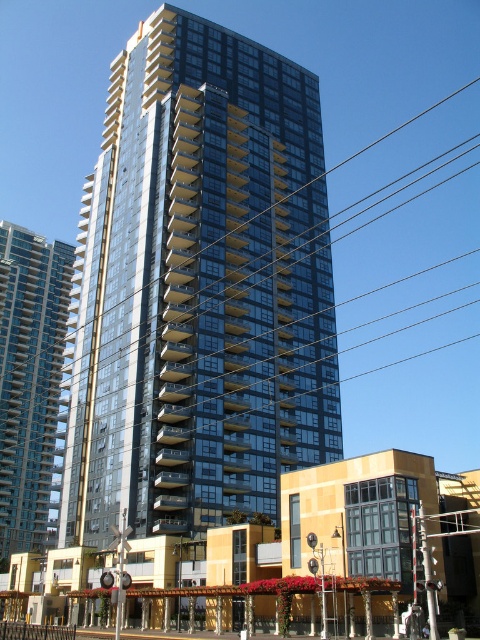
Question: Can you confirm if glassy reflective building at center is positioned to the right of transparent glass building at center?

Choices:
 (A) no
 (B) yes

Answer: (B)

Question: Which point is farther to the camera?

Choices:
 (A) (210, 484)
 (B) (10, 294)

Answer: (B)

Question: Which object is closer to the camera taking this photo?

Choices:
 (A) transparent glass building at center
 (B) glassy reflective building at center

Answer: (B)

Question: Observing the image, what is the correct spatial positioning of glassy reflective building at center in reference to transparent glass building at center?

Choices:
 (A) below
 (B) above

Answer: (B)

Question: Can you confirm if glassy reflective building at center is smaller than transparent glass building at center?

Choices:
 (A) yes
 (B) no

Answer: (B)